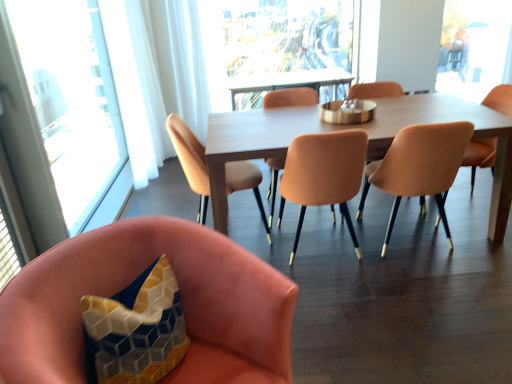
I want to click on free spot in front of matte orange chair at center, which appears as the third chair when viewed from the right, so pyautogui.click(x=352, y=290).